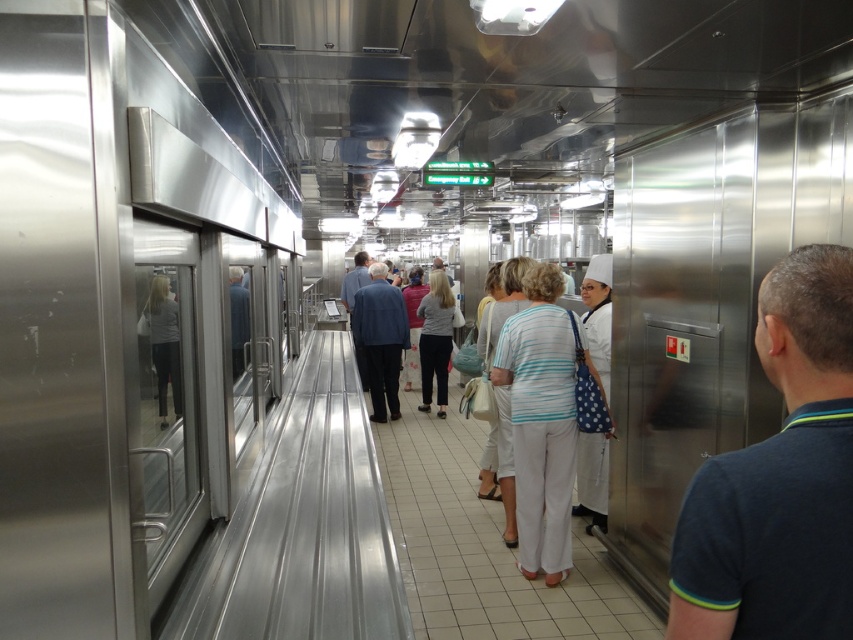
Can you confirm if white chef hat at center is bigger than light gray fabric pants at center?

No.

Is white chef hat at center positioned before light gray fabric pants at center?

Yes, white chef hat at center is closer to the viewer.

This screenshot has width=853, height=640. Describe the element at coordinates (560, 499) in the screenshot. I see `white chef hat at center` at that location.

Where is `white chef hat at center`? The height and width of the screenshot is (640, 853). white chef hat at center is located at coordinates (560, 499).

Who is more distant from viewer, [369,358] or [585,333]?

The point [369,358] is more distant.

Which is in front, point (368, 289) or point (590, 452)?

Positioned in front is point (590, 452).

Locate an element on the screen. blue fabric jacket at center is located at coordinates (380, 339).

Does point (421, 378) come closer to viewer compared to point (152, 289)?

No, it is not.

Does point (427, 353) come in front of point (177, 326)?

That is False.

Locate an element on the screen. The height and width of the screenshot is (640, 853). light gray fabric pants at center is located at coordinates (434, 339).